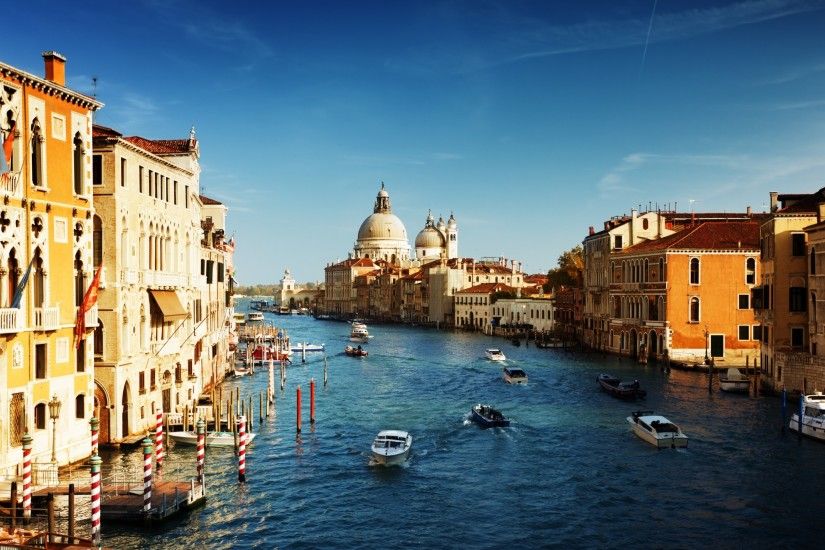
The image size is (825, 550). I want to click on light, so click(x=52, y=419).